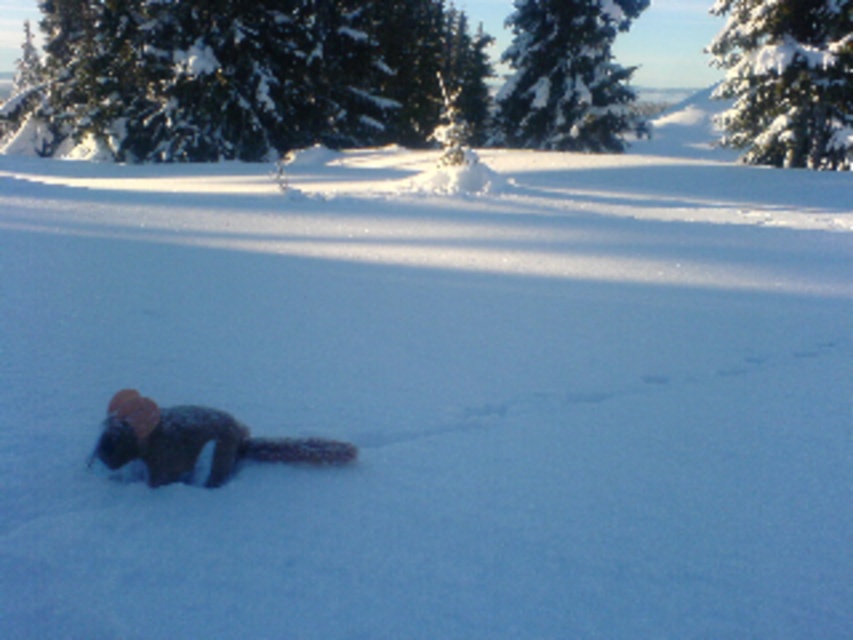
Between snow-covered evergreen at upper right and snow-covered evergreen at upper center, which one is positioned higher?

Positioned higher is snow-covered evergreen at upper right.

Does point (770, 74) come in front of point (630, 112)?

Yes.

Where is `snow-covered evergreen at upper right`? The height and width of the screenshot is (640, 853). snow-covered evergreen at upper right is located at coordinates (786, 81).

Is snow-covered evergreen at upper right thinner than fuzzy brown animal at center?

No.

Is snow-covered evergreen at upper right positioned at the back of fuzzy brown animal at center?

Yes.

Is point (735, 12) in front of point (123, 397)?

No, it is behind (123, 397).

The width and height of the screenshot is (853, 640). Identify the location of snow-covered evergreen at upper right. (786, 81).

Who is shorter, snow-covered evergreen at upper center or fuzzy brown animal at center?

With less height is fuzzy brown animal at center.

Between snow-covered evergreen at upper center and fuzzy brown animal at center, which one appears on the right side from the viewer's perspective?

Positioned to the right is snow-covered evergreen at upper center.

Does point (550, 22) lie in front of point (192, 444)?

No, (550, 22) is behind (192, 444).

Where is `snow-covered evergreen at upper center`? The height and width of the screenshot is (640, 853). snow-covered evergreen at upper center is located at coordinates (566, 76).